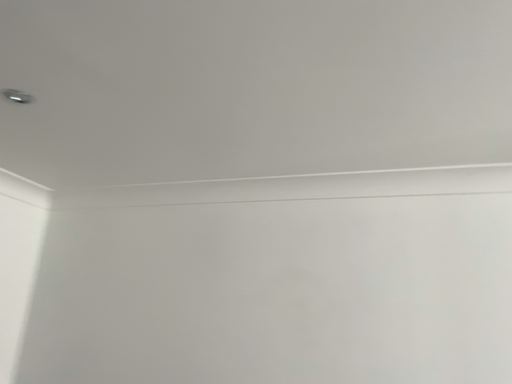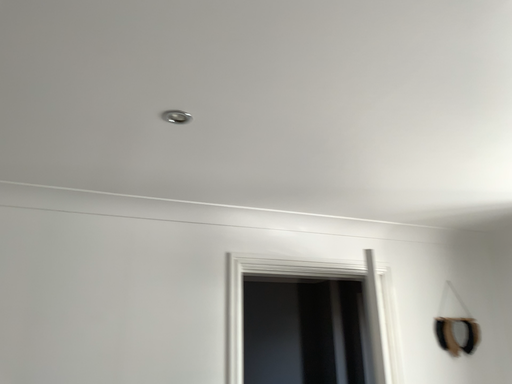
Question: How did the camera likely rotate when shooting the video?

Choices:
 (A) rotated right
 (B) rotated left

Answer: (A)